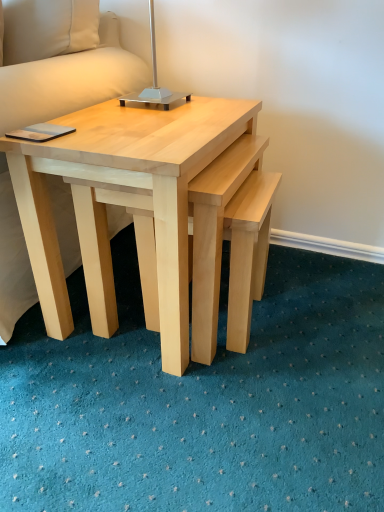
Locate an element on the screen. This screenshot has width=384, height=512. vacant space in front of metallic silver table lamp at upper center is located at coordinates (153, 122).